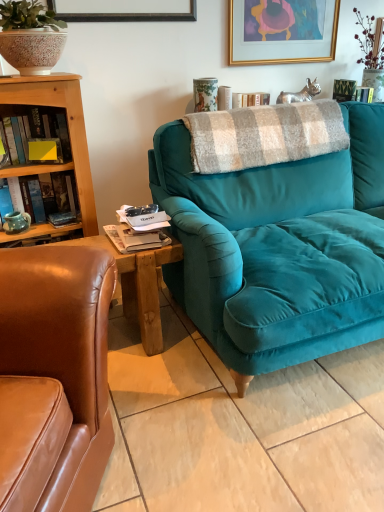
Question: Is gold-framed artwork at upper center oriented towards yellow matte sticky note at left, the first book in the top-to-bottom sequence?

Choices:
 (A) no
 (B) yes

Answer: (A)

Question: Does gold-framed artwork at upper center have a lesser width compared to yellow matte sticky note at left, the first book in the top-to-bottom sequence?

Choices:
 (A) yes
 (B) no

Answer: (A)

Question: Can you confirm if gold-framed artwork at upper center is positioned to the left of yellow matte sticky note at left, the second book in the bottom-to-top sequence?

Choices:
 (A) no
 (B) yes

Answer: (A)

Question: Is yellow matte sticky note at left, the second book in the bottom-to-top sequence, completely or partially inside gold-framed artwork at upper center?

Choices:
 (A) no
 (B) yes

Answer: (A)

Question: Does gold-framed artwork at upper center lie in front of yellow matte sticky note at left, the second book in the bottom-to-top sequence?

Choices:
 (A) no
 (B) yes

Answer: (A)

Question: Can you confirm if gold-framed artwork at upper center is taller than yellow matte sticky note at left, the second book in the bottom-to-top sequence?

Choices:
 (A) no
 (B) yes

Answer: (B)

Question: Considering the relative positions of teal velvet couch at center and teal matte mug at left, acting as the first book starting from the bottom, in the image provided, is teal velvet couch at center to the right of teal matte mug at left, acting as the first book starting from the bottom, from the viewer's perspective?

Choices:
 (A) no
 (B) yes

Answer: (B)

Question: Is teal velvet couch at center taller than teal matte mug at left, acting as the first book starting from the bottom?

Choices:
 (A) yes
 (B) no

Answer: (A)

Question: Is teal velvet couch at center positioned far away from teal matte mug at left, which is counted as the second book, starting from the top?

Choices:
 (A) yes
 (B) no

Answer: (B)

Question: Does teal velvet couch at center have a lesser height compared to teal matte mug at left, which is counted as the second book, starting from the top?

Choices:
 (A) no
 (B) yes

Answer: (A)

Question: Is teal velvet couch at center positioned with its back to teal matte mug at left, which is counted as the second book, starting from the top?

Choices:
 (A) yes
 (B) no

Answer: (B)

Question: Can you confirm if teal velvet couch at center is positioned to the left of teal matte mug at left, acting as the first book starting from the bottom?

Choices:
 (A) yes
 (B) no

Answer: (B)

Question: Are teal matte mug at left, which is counted as the second book, starting from the top, and yellow matte sticky note at left, the second book in the bottom-to-top sequence, far apart?

Choices:
 (A) no
 (B) yes

Answer: (A)